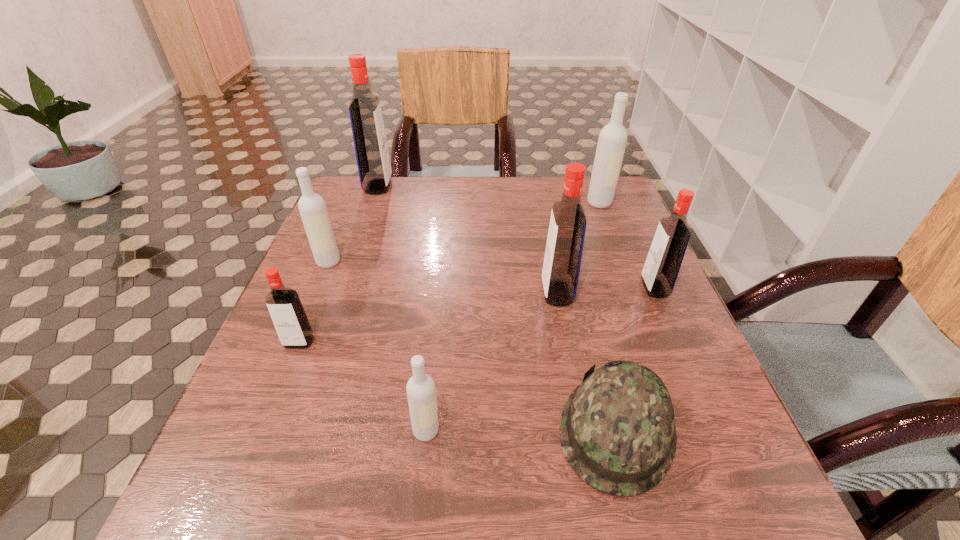
Identify the location of the nearest red vodka. The image size is (960, 540). (287, 313).

Identify the location of the second white vodka from right to left. (421, 393).

At what (x,y) coordinates should I click in order to perform the action: click on the nearest white vodka. Please return your answer as a coordinate pair (x, y). This screenshot has height=540, width=960. Looking at the image, I should click on (421, 393).

Where is `headwear`? The image size is (960, 540). headwear is located at coordinates (617, 430).

Image resolution: width=960 pixels, height=540 pixels. Find the location of `free region located on the front and back of the tallest object`. free region located on the front and back of the tallest object is located at coordinates (435, 186).

Locate an element on the screen. This screenshot has width=960, height=540. vacant region located 0.050m on the back of the farthest white vodka is located at coordinates (594, 187).

This screenshot has width=960, height=540. Identify the location of free region located 0.390m on the front and back of the second red vodka from right to left. (363, 293).

Find the location of a particular element. blank space located on the front and back of the second red vodka from right to left is located at coordinates (496, 293).

Identify the location of vacant space situated 0.210m on the front and back of the second red vodka from right to left. Image resolution: width=960 pixels, height=540 pixels. (445, 293).

Image resolution: width=960 pixels, height=540 pixels. I want to click on free space located 0.230m on the right of the leftmost white vodka, so click(x=438, y=262).